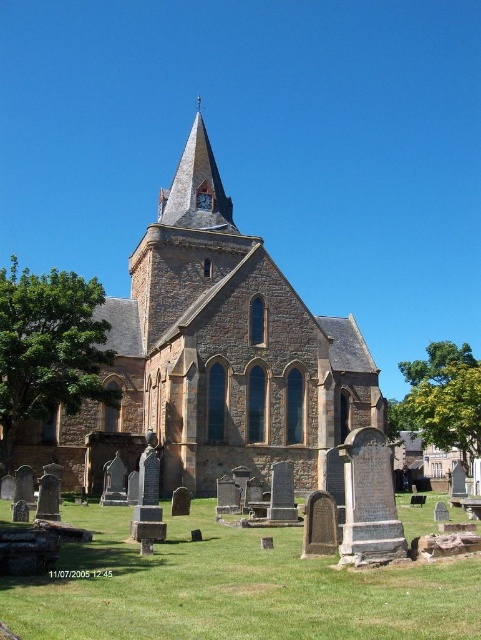
Can you confirm if brown stone church at center is positioned to the right of smooth stone spire at upper center?

Correct, you'll find brown stone church at center to the right of smooth stone spire at upper center.

How far apart are brown stone church at center and smooth stone spire at upper center?

The distance of brown stone church at center from smooth stone spire at upper center is 16.95 meters.

Is point (164, 244) positioned after point (182, 209)?

No, it is in front of (182, 209).

Where is `brown stone church at center`? The height and width of the screenshot is (640, 481). brown stone church at center is located at coordinates (215, 355).